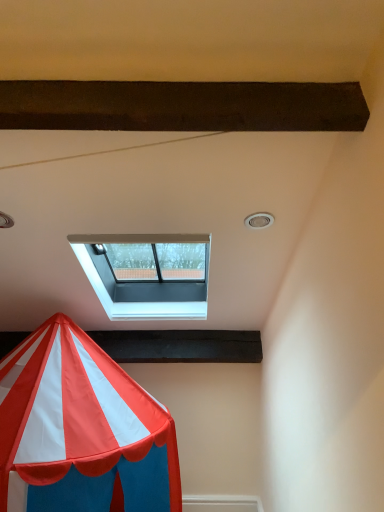
What is the approximate height of white plastic window at center?

15.93 inches.

Based on the photo, measure the distance between white plastic window at center and camera.

white plastic window at center is 1.46 meters from camera.

Image resolution: width=384 pixels, height=512 pixels. What do you see at coordinates (147, 274) in the screenshot?
I see `white plastic window at center` at bounding box center [147, 274].

You are a GUI agent. You are given a task and a screenshot of the screen. Output one action in this format:
    pyautogui.click(x=<x>, y=<y>)
    Task: Click on the white plastic window at center
    The width and height of the screenshot is (384, 512).
    Given the screenshot: What is the action you would take?
    pyautogui.click(x=147, y=274)

The height and width of the screenshot is (512, 384). What are the coordinates of `white plastic window at center` in the screenshot? It's located at (147, 274).